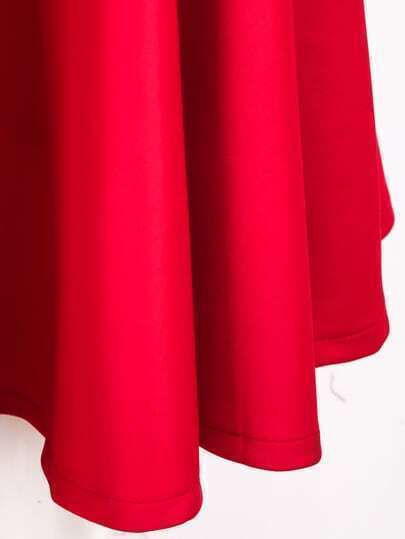
I want to click on shower curtain, so (x=271, y=377), (x=134, y=400).